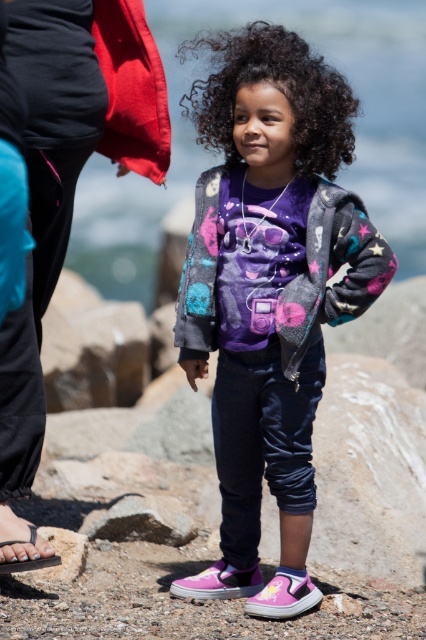
Question: Can you confirm if transparent water at center is positioned to the left of gray rough rock at lower center?

Choices:
 (A) no
 (B) yes

Answer: (A)

Question: Is the position of fuzzy gray jacket at center less distant than that of transparent water at center?

Choices:
 (A) yes
 (B) no

Answer: (A)

Question: Which object appears farthest from the camera in this image?

Choices:
 (A) gray rough rock at lower center
 (B) transparent water at center
 (C) blue flip-flop at lower left
 (D) fuzzy gray jacket at center

Answer: (A)

Question: Which of the following is the closest to the observer?

Choices:
 (A) fuzzy gray jacket at center
 (B) blue flip-flop at lower left
 (C) gray rough rock at lower center

Answer: (A)

Question: Can you confirm if transparent water at center is positioned above blue flip-flop at lower left?

Choices:
 (A) yes
 (B) no

Answer: (A)

Question: Which object is farther from the camera taking this photo?

Choices:
 (A) transparent water at center
 (B) fuzzy gray jacket at center
 (C) blue flip-flop at lower left

Answer: (A)